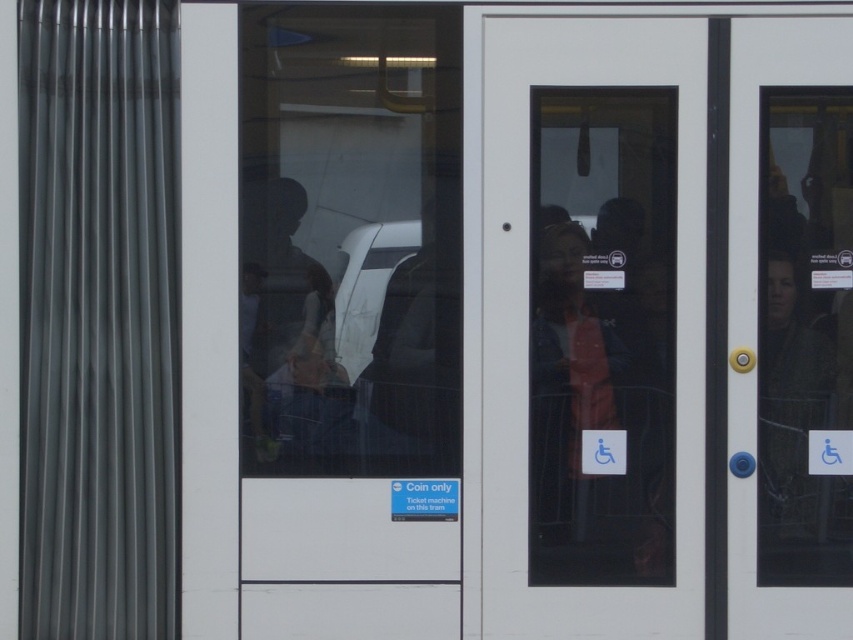
Question: Which point appears closest to the camera in this image?

Choices:
 (A) (498, 99)
 (B) (566, 502)

Answer: (A)

Question: Which of the following is the closest to the observer?

Choices:
 (A) matte black jacket at center
 (B) white glossy door at center

Answer: (B)

Question: Can you confirm if white glossy door at center is positioned to the right of matte black jacket at center?

Choices:
 (A) yes
 (B) no

Answer: (A)

Question: Does white glossy door at center appear over matte black jacket at center?

Choices:
 (A) no
 (B) yes

Answer: (B)

Question: Which of the following is the farthest from the observer?

Choices:
 (A) matte black jacket at center
 (B) white glossy door at center

Answer: (A)

Question: Can you confirm if white glossy door at center is thinner than matte black jacket at center?

Choices:
 (A) yes
 (B) no

Answer: (B)